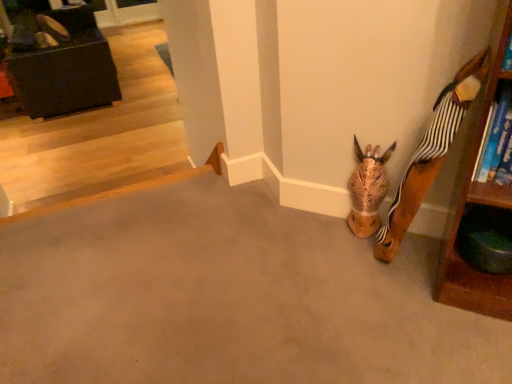
Question: Is matte brown shoe at upper left at the back of brown textured animal head at lower right?

Choices:
 (A) yes
 (B) no

Answer: (B)

Question: Considering the relative sizes of brown textured animal head at lower right and matte brown shoe at upper left in the image provided, is brown textured animal head at lower right thinner than matte brown shoe at upper left?

Choices:
 (A) yes
 (B) no

Answer: (A)

Question: From a real-world perspective, is brown textured animal head at lower right positioned over matte brown shoe at upper left based on gravity?

Choices:
 (A) yes
 (B) no

Answer: (A)

Question: Is brown textured animal head at lower right positioned before matte brown shoe at upper left?

Choices:
 (A) yes
 (B) no

Answer: (A)

Question: Could you tell me if brown textured animal head at lower right is facing matte brown shoe at upper left?

Choices:
 (A) yes
 (B) no

Answer: (B)

Question: Does brown textured animal head at lower right touch matte brown shoe at upper left?

Choices:
 (A) yes
 (B) no

Answer: (B)

Question: From a real-world perspective, is matte black ottoman at upper left physically below wooden giraffe head at lower right?

Choices:
 (A) yes
 (B) no

Answer: (A)

Question: From the image's perspective, is matte black ottoman at upper left below wooden giraffe head at lower right?

Choices:
 (A) no
 (B) yes

Answer: (A)

Question: Is matte black ottoman at upper left closer to the viewer compared to wooden giraffe head at lower right?

Choices:
 (A) yes
 (B) no

Answer: (B)

Question: Does matte black ottoman at upper left appear on the left side of wooden giraffe head at lower right?

Choices:
 (A) yes
 (B) no

Answer: (A)

Question: Is matte black ottoman at upper left not near wooden giraffe head at lower right?

Choices:
 (A) no
 (B) yes

Answer: (B)

Question: Considering the relative sizes of matte black ottoman at upper left and wooden giraffe head at lower right in the image provided, is matte black ottoman at upper left smaller than wooden giraffe head at lower right?

Choices:
 (A) yes
 (B) no

Answer: (B)

Question: Does brown matte concrete at lower right turn towards brown textured animal head at lower right?

Choices:
 (A) yes
 (B) no

Answer: (B)